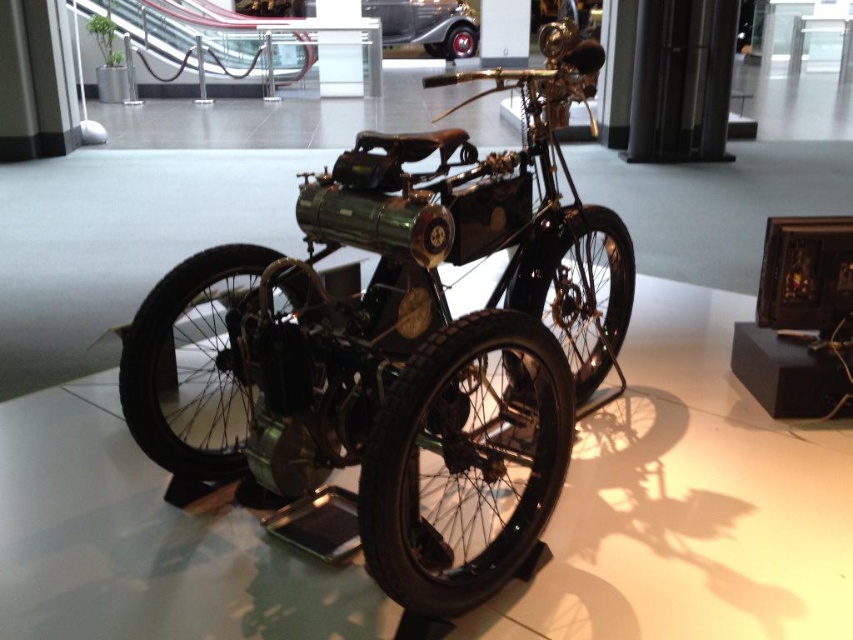
Is shiny black motorcycle at center above shiny chrome car at center?

Actually, shiny black motorcycle at center is below shiny chrome car at center.

Is point (474, 493) positioned before point (450, 42)?

That is True.

Describe the element at coordinates (399, 342) in the screenshot. This screenshot has height=640, width=853. I see `shiny black motorcycle at center` at that location.

You are a GUI agent. You are given a task and a screenshot of the screen. Output one action in this format:
    pyautogui.click(x=<x>, y=<y>)
    Task: Click on the shiny black motorcycle at center
    The image size is (853, 640).
    Given the screenshot: What is the action you would take?
    pyautogui.click(x=399, y=342)